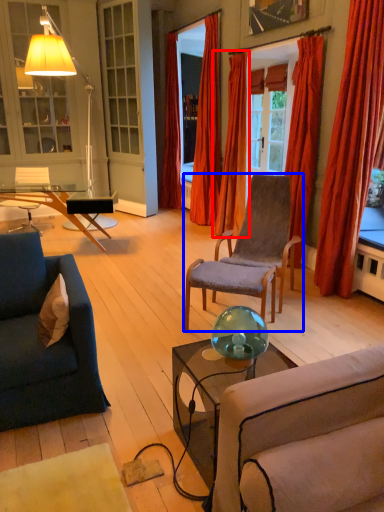
Question: Which object is closer to the camera taking this photo, curtain (highlighted by a red box) or chair (highlighted by a blue box)?

Choices:
 (A) curtain
 (B) chair

Answer: (B)